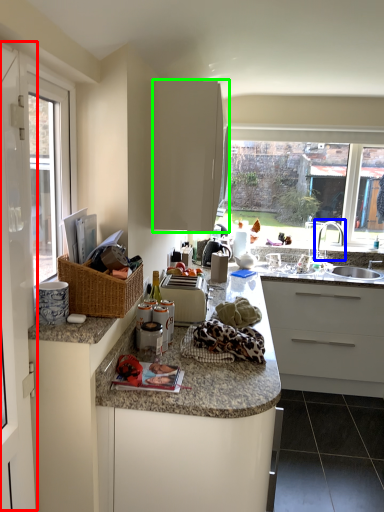
Question: Estimate the real-world distances between objects in this image. Which object is closer to screen door (highlighted by a red box), tap (highlighted by a blue box) or cabinetry (highlighted by a green box)?

Choices:
 (A) tap
 (B) cabinetry

Answer: (B)